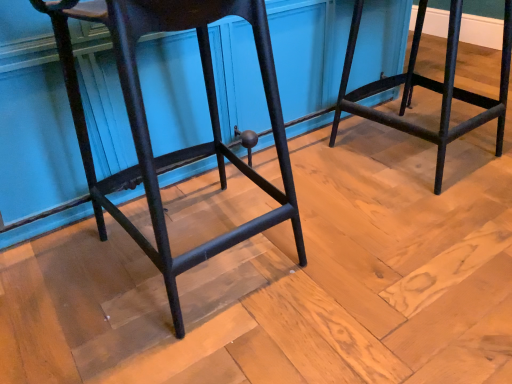
Question: From the image's perspective, is black metal stool at right, which ranks as the first furniture in right-to-left order, positioned above or below matte black stool at center, the 2th furniture from the right?

Choices:
 (A) above
 (B) below

Answer: (A)

Question: In terms of size, does black metal stool at right, the second furniture viewed from the left, appear bigger or smaller than matte black stool at center, which is counted as the first furniture, starting from the left?

Choices:
 (A) big
 (B) small

Answer: (B)

Question: Is black metal stool at right, the second furniture viewed from the left, in front of or behind matte black stool at center, the 2th furniture from the right, in the image?

Choices:
 (A) front
 (B) behind

Answer: (B)

Question: Relative to black metal stool at right, the second furniture viewed from the left, is matte black stool at center, which is counted as the first furniture, starting from the left, in front or behind?

Choices:
 (A) behind
 (B) front

Answer: (B)

Question: Is point coord(109,6) positioned closer to the camera than point coord(493,117)?

Choices:
 (A) farther
 (B) closer

Answer: (B)

Question: From the image's perspective, is matte black stool at center, the 2th furniture from the right, positioned above or below black metal stool at right, which ranks as the first furniture in right-to-left order?

Choices:
 (A) above
 (B) below

Answer: (B)

Question: Considering the positions of matte black stool at center, which is counted as the first furniture, starting from the left, and black metal stool at right, which ranks as the first furniture in right-to-left order, in the image, is matte black stool at center, which is counted as the first furniture, starting from the left, bigger or smaller than black metal stool at right, which ranks as the first furniture in right-to-left order,?

Choices:
 (A) small
 (B) big

Answer: (B)